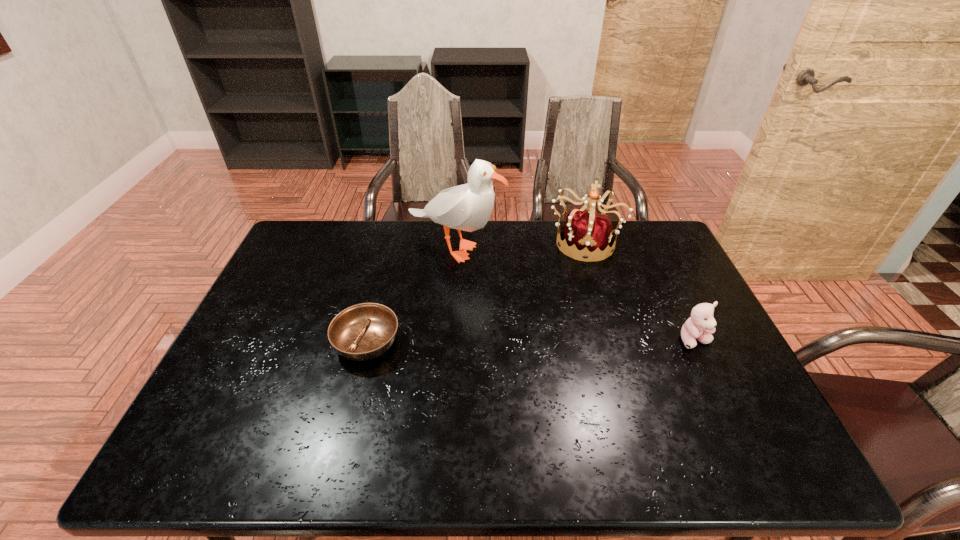
The image size is (960, 540). I want to click on free spot between the shortest object and the tallest object, so click(411, 294).

Where is `free space between the third tallest object and the third shortest object`? free space between the third tallest object and the third shortest object is located at coordinates (639, 291).

Locate an element on the screen. This screenshot has height=540, width=960. object that stands as the closest to the tiara is located at coordinates (467, 207).

Locate which object is the closest to the teddy bear. Please provide its 2D coordinates. Your answer should be formatted as a tuple, i.e. [(x, y)], where the tuple contains the x and y coordinates of a point satisfying the conditions above.

[(585, 229)]

This screenshot has width=960, height=540. In order to click on free space that satisfies the following two spatial constraints: 1. on the back side of the tiara; 2. on the left side of the soup bowl in this screenshot , I will do `click(392, 242)`.

Locate an element on the screen. The width and height of the screenshot is (960, 540). vacant area that satisfies the following two spatial constraints: 1. on the back side of the tiara; 2. on the left side of the shortest object is located at coordinates (392, 242).

Identify the location of free location that satisfies the following two spatial constraints: 1. on the back side of the third shortest object; 2. on the right side of the shortest object. (392, 242).